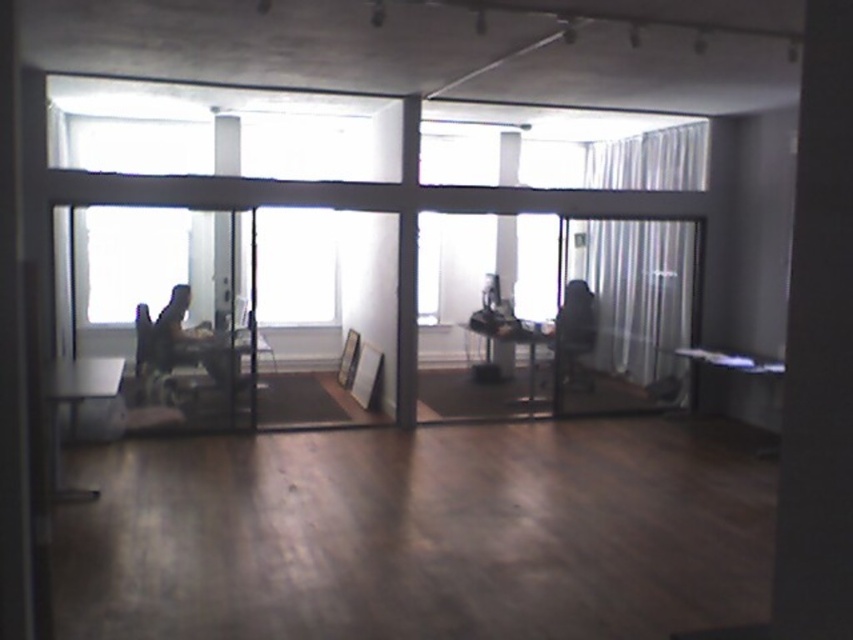
You are standing at the entrance of the office and want to move to the black fabric chair at center. There is a dark gray fabric chair at left blocking your path. Can you walk around it to reach your destination?

The dark gray fabric chair at left is in front of the black fabric chair at center, so you can walk around it to reach the black fabric chair at center.

In the scene shown: You are an office worker who wants to move a potted plant from the desk to a spot near the transparent glass window at center. However, there is a black fabric chair at center in the way. Can you move the plant around the chair to reach the window?

The transparent glass window at center is larger in size than black fabric chair at center. Since the window is bigger, there is likely enough space around the smaller chair to maneuver the plant to the window.